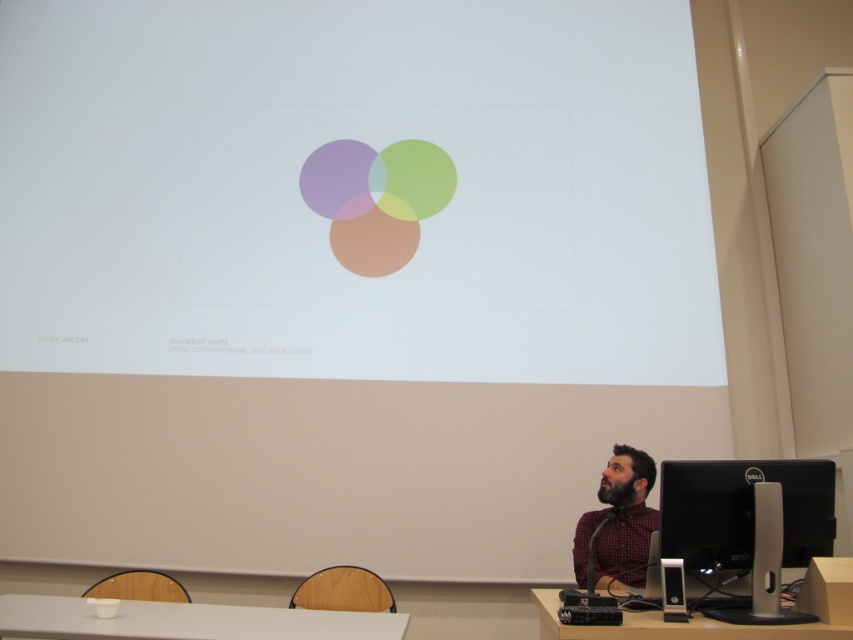
You are setting up a presentation in the classroom and need to place a laptop on the table. The laptop requires a minimum of 50 cm of space. Can the black glossy monitor at lower right fit on the white glossy table at lower center based on their widths?

The black glossy monitor at lower right has a width less than the white glossy table at lower center, so it can fit on the table.

You are a student in the classroom and need to determine which object is taller between the plaid fabric shirt at lower right and the wooden table at lower right. Which one is taller?

The plaid fabric shirt at lower right is taller than the wooden table at lower right according to the description.